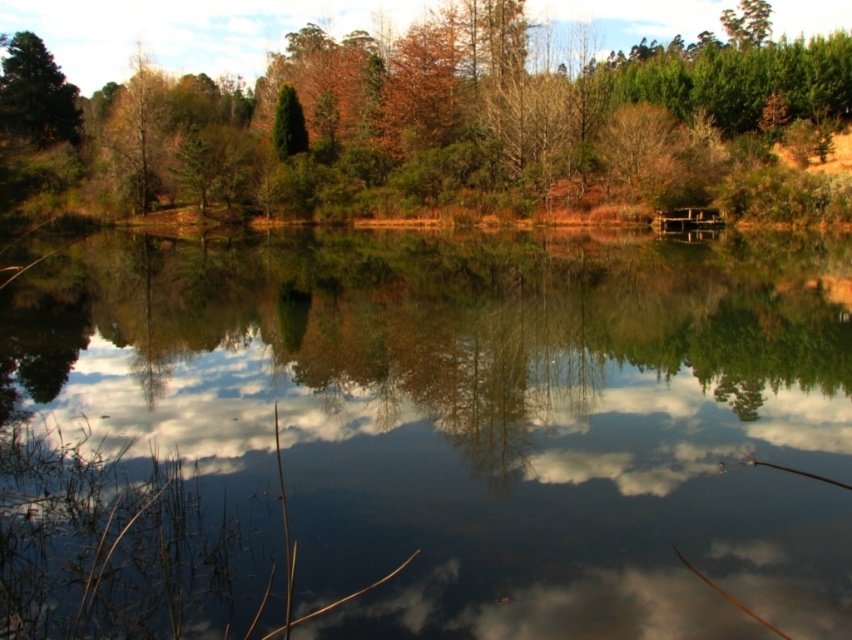
Question: Does transparent water at center have a larger size compared to green matte tree at upper left?

Choices:
 (A) no
 (B) yes

Answer: (B)

Question: Considering the real-world distances, which object is closest to the green matte tree at center?

Choices:
 (A) transparent water at center
 (B) green matte tree at upper left

Answer: (B)

Question: Does green matte tree at center come in front of green matte tree at upper left?

Choices:
 (A) yes
 (B) no

Answer: (A)

Question: Which object appears closest to the camera in this image?

Choices:
 (A) green matte tree at upper left
 (B) transparent water at center

Answer: (B)

Question: Which point is farther to the camera?

Choices:
 (A) (775, 61)
 (B) (33, 35)
 (C) (631, 456)

Answer: (B)

Question: Is transparent water at center bigger than green matte tree at center?

Choices:
 (A) no
 (B) yes

Answer: (A)